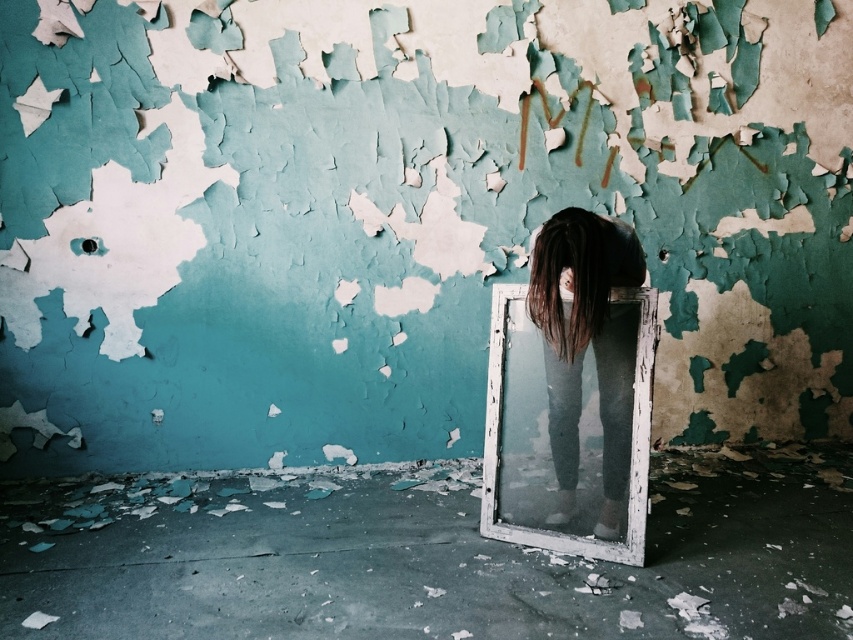
You are an observer looking at the scene. You notice two instances of dark brown hair at center and dark brown silky hair at center. Which one is covering the other?

The dark brown silky hair at center is covering the dark brown hair at center because it is positioned above it.

You are a photographer trying to capture the scene in the image. You notice two strands of dark brown hair at center and dark brown silky hair at center near the mirror. Since you want to ensure both strands are in focus, what is the minimum distance your camera lens should be set to focus on?

The dark brown hair at center is 1.96 inches from the dark brown silky hair at center, so the minimum focusing distance should be set to at least 1.96 inches to ensure both strands are in focus.

You are standing in the dilapidated room and see two points marked in the scene. Which point is closer to you, point [636,252] or point [569,324]?

Point [636,252] is further to the viewer than point [569,324], so point [569,324] is closer to you.